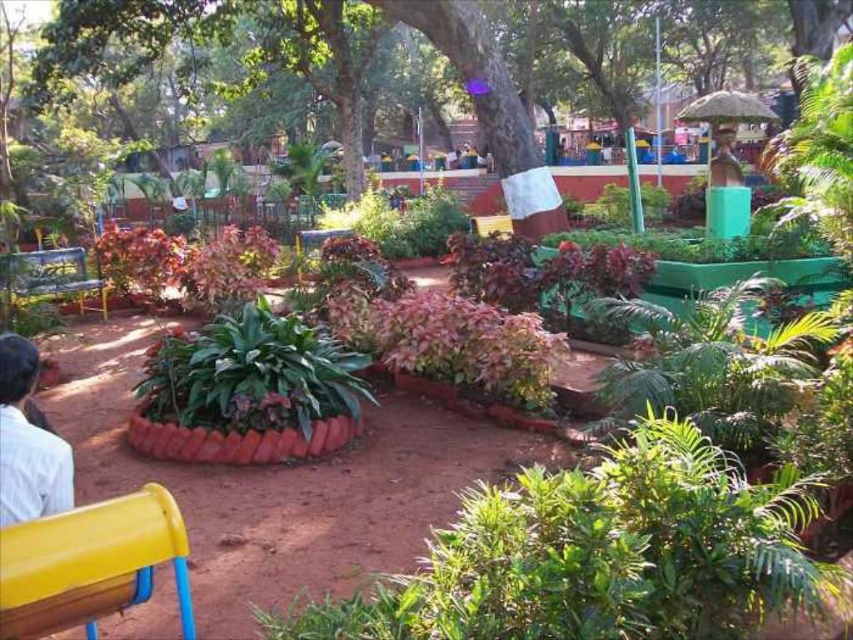
Question: Can you confirm if green textured tree at center is smaller than yellow plastic bench at lower left?

Choices:
 (A) no
 (B) yes

Answer: (A)

Question: Is yellow plastic bench at lower left positioned at the back of white cloth at lower left?

Choices:
 (A) yes
 (B) no

Answer: (B)

Question: Which object is the farthest from the green textured tree at center?

Choices:
 (A) white cloth at lower left
 (B) yellow plastic bench at lower left

Answer: (A)

Question: Is yellow plastic bench at lower left wider than metallic green bench at left?

Choices:
 (A) no
 (B) yes

Answer: (A)

Question: Which object is the closest to the white cloth at lower left?

Choices:
 (A) metallic green bench at left
 (B) green textured tree at center
 (C) yellow plastic bench at lower left

Answer: (C)

Question: Among these objects, which one is farthest from the camera?

Choices:
 (A) metallic green bench at left
 (B) green textured tree at center
 (C) yellow plastic bench at lower left
 (D) white cloth at lower left

Answer: (B)